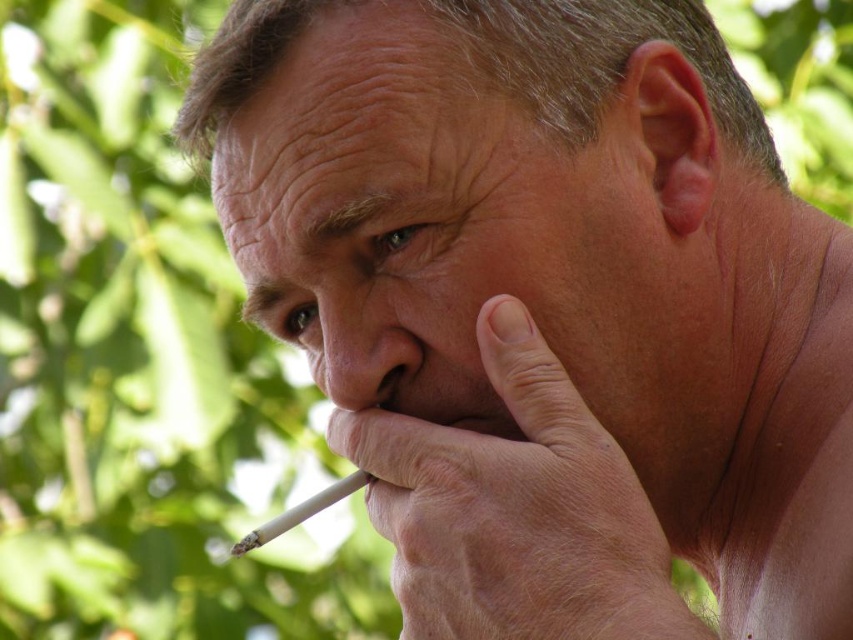
You are a photographer trying to capture the white matte cigarette at lower center and the green leafy tree at left in the same frame. Which object should you adjust your camera to focus on first if you want the cigarette to be in focus while keeping the tree partially visible?

The green leafy tree at left is positioned on the left side of white matte cigarette at lower center. To focus on the cigarette while keeping the tree partially visible, adjust your camera to focus on the white matte cigarette at lower center first, as it is closer to the camera than the tree.

You are a photographer trying to capture the white matte cigarette at lower center and the green leafy tree at left in the same frame. Which object would you need to adjust your camera focus to capture more clearly if you want to focus on the one that is closer to the camera?

The green leafy tree at left is further away from the camera than the white matte cigarette at lower center, so to focus on the closer object, you should adjust your camera focus to the white matte cigarette at lower center.

You are a photographer adjusting your camera settings to focus on the white matte cigarette at lower center. Considering the green leafy tree at left is closer to you, will the tree appear more or less sharp in the photo compared to the cigarette?

The green leafy tree at left is closer to you than the white matte cigarette at lower center, so the tree will appear less sharp in the photo because it is outside the focal plane of the camera focused on the cigarette.